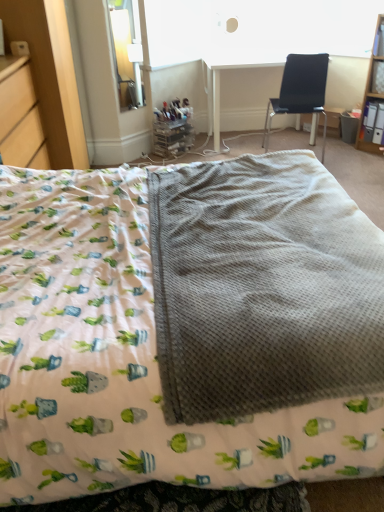
This screenshot has width=384, height=512. I want to click on wooden shelf at upper right, so click(373, 90).

In order to face wooden file cabinet at left, should I rotate leftwards or rightwards?

Turn left by 25.059 degrees to look at wooden file cabinet at left.

At what (x,y) coordinates should I click in order to perform the action: click on gray waffle-textured blanket at center. Please return your answer as a coordinate pair (x, y). The image size is (384, 512). Looking at the image, I should click on (262, 287).

Describe the element at coordinates (220, 92) in the screenshot. This screenshot has width=384, height=512. I see `white plastic table at upper center` at that location.

Where is `wooden dresser at left`? wooden dresser at left is located at coordinates (x=50, y=75).

What do you see at coordinates (187, 328) in the screenshot? I see `waffle-textured blanket at center` at bounding box center [187, 328].

This screenshot has width=384, height=512. I want to click on wooden shelf at upper right, so click(373, 90).

How different are the orientations of wooden dresser at left and waffle-textured blanket at center in degrees?

The angular difference between wooden dresser at left and waffle-textured blanket at center is 0.0465 degrees.

Would you say wooden dresser at left is inside or outside waffle-textured blanket at center?

The correct answer is: outside.

From a real-world perspective, is wooden dresser at left positioned above or below waffle-textured blanket at center?

Clearly, from a real-world perspective, wooden dresser at left is above waffle-textured blanket at center.

Does wooden dresser at left have a lesser width compared to waffle-textured blanket at center?

Indeed, wooden dresser at left has a lesser width compared to waffle-textured blanket at center.

Which of these two, wooden dresser at left or black fabric chair at upper right, is thinner?

black fabric chair at upper right.

Is wooden dresser at left oriented towards black fabric chair at upper right?

Yes, wooden dresser at left is facing black fabric chair at upper right.

Is wooden dresser at left with black fabric chair at upper right?

No.

Which is in front, point (60, 26) or point (315, 92)?

The point (60, 26) is closer.

Consider the image. Who is more distant, wooden shelf at upper right or gray waffle-textured blanket at center?

wooden shelf at upper right.

From the image's perspective, between wooden shelf at upper right and gray waffle-textured blanket at center, which one is located above?

From the image's view, wooden shelf at upper right is above.

From a real-world perspective, is wooden shelf at upper right beneath gray waffle-textured blanket at center?

Indeed, from a real-world perspective, wooden shelf at upper right is positioned beneath gray waffle-textured blanket at center.

In the scene shown: Would you consider clear glass window screen at upper left to be distant from white plastic table at upper center?

No.

Find the location of a particular element. This screenshot has width=384, height=512. window screen above the white plastic table at upper center (from the image's perspective) is located at coordinates tap(126, 51).

How many degrees apart are the facing directions of clear glass window screen at upper left and white plastic table at upper center?

clear glass window screen at upper left and white plastic table at upper center are facing 47.5 degrees away from each other.

Considering the positions of objects clear glass window screen at upper left and white plastic table at upper center in the image provided, who is behind, clear glass window screen at upper left or white plastic table at upper center?

white plastic table at upper center is further away from the camera.

Could you tell me if gray waffle-textured blanket at center is turned towards black fabric chair at upper right?

No, gray waffle-textured blanket at center is not aimed at black fabric chair at upper right.

Would you consider gray waffle-textured blanket at center to be distant from black fabric chair at upper right?

Indeed, gray waffle-textured blanket at center is not near black fabric chair at upper right.

Who is bigger, gray waffle-textured blanket at center or black fabric chair at upper right?

black fabric chair at upper right is bigger.

Can you tell me how much gray waffle-textured blanket at center and black fabric chair at upper right differ in facing direction?

87.1 degrees separate the facing orientations of gray waffle-textured blanket at center and black fabric chair at upper right.

From a real-world perspective, is wooden file cabinet at left physically below white plastic table at upper center?

No, from a real-world perspective, wooden file cabinet at left is not below white plastic table at upper center.

Considering the positions of objects wooden file cabinet at left and white plastic table at upper center in the image provided, who is behind, wooden file cabinet at left or white plastic table at upper center?

Positioned behind is white plastic table at upper center.

Is wooden file cabinet at left spatially inside white plastic table at upper center, or outside of it?

wooden file cabinet at left is not enclosed by white plastic table at upper center.

Are gray waffle-textured blanket at center and wooden shelf at upper right making contact?

No, gray waffle-textured blanket at center is not beside wooden shelf at upper right.

Which object is thinner, gray waffle-textured blanket at center or wooden shelf at upper right?

Thinner between the two is wooden shelf at upper right.

Which object is positioned more to the left, gray waffle-textured blanket at center or wooden shelf at upper right?

gray waffle-textured blanket at center.

Is gray waffle-textured blanket at center located outside wooden shelf at upper right?

Indeed, gray waffle-textured blanket at center is completely outside wooden shelf at upper right.

Find the location of a particular element. bed below the wooden dresser at left (from a real-world perspective) is located at coordinates (187, 328).

Find the location of a particular element. chair behind the wooden dresser at left is located at coordinates (300, 91).

From the image, which object appears to be nearer to white plastic table at upper center, gray waffle-textured blanket at center or clear glass window screen at upper left?

clear glass window screen at upper left lies closer to white plastic table at upper center than the other object.

Which object lies nearer to the anchor point waffle-textured blanket at center, black fabric chair at upper right or wooden file cabinet at left?

wooden file cabinet at left.

Based on the photo, which object lies nearer to the anchor point clear glass window screen at upper left, gray waffle-textured blanket at center or wooden shelf at upper right?

wooden shelf at upper right lies closer to clear glass window screen at upper left than the other object.

Looking at the image, which one is located further to white plastic table at upper center, wooden shelf at upper right or wooden dresser at left?

wooden dresser at left is further to white plastic table at upper center.

Estimate the real-world distances between objects in this image. Which object is closer to clear glass window screen at upper left, white plastic table at upper center or gray waffle-textured blanket at center?

white plastic table at upper center is closer to clear glass window screen at upper left.

When comparing their distances from waffle-textured blanket at center, does black fabric chair at upper right or clear glass window screen at upper left seem further?

clear glass window screen at upper left.

Based on their spatial positions, is gray waffle-textured blanket at center or clear glass window screen at upper left further from black fabric chair at upper right?

The object further to black fabric chair at upper right is gray waffle-textured blanket at center.

Based on their spatial positions, is gray waffle-textured blanket at center or black fabric chair at upper right closer to wooden file cabinet at left?

gray waffle-textured blanket at center lies closer to wooden file cabinet at left than the other object.

Locate an element on the screen. dresser between wooden file cabinet at left and clear glass window screen at upper left in the front-back direction is located at coordinates (50, 75).

Image resolution: width=384 pixels, height=512 pixels. Identify the location of dresser between gray waffle-textured blanket at center and black fabric chair at upper right along the z-axis. (50, 75).

Identify the location of dresser between gray waffle-textured blanket at center and white plastic table at upper center from front to back. (50, 75).

Find the location of a particular element. This screenshot has width=384, height=512. shelf between gray waffle-textured blanket at center and white plastic table at upper center along the z-axis is located at coordinates (373, 90).